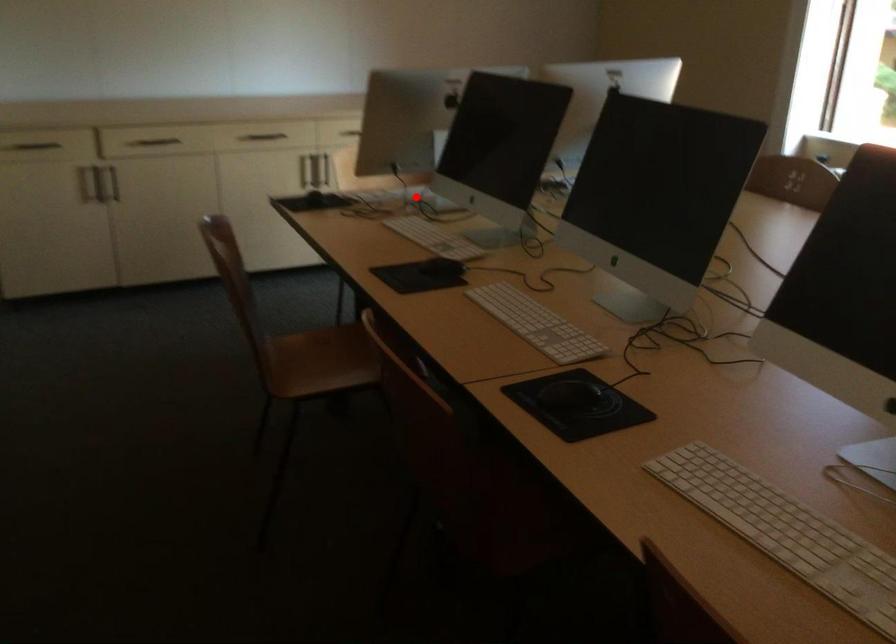
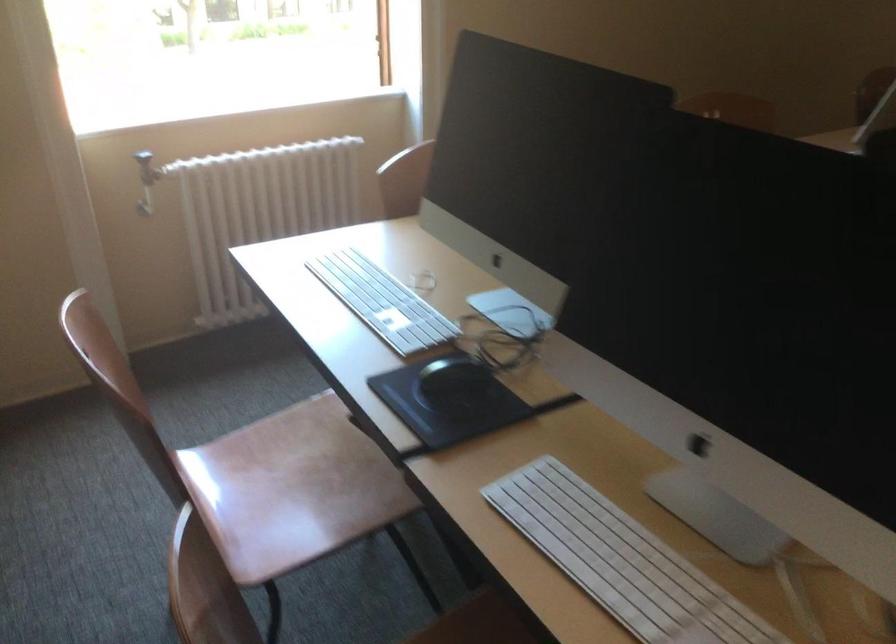
Question: A red point is marked in image1. In image2, is the corresponding 3D point closer to the camera or farther? Reply with the corresponding letter.

Choices:
 (A) The corresponding 3D point is closer.
 (B) The corresponding 3D point is farther.

Answer: (A)